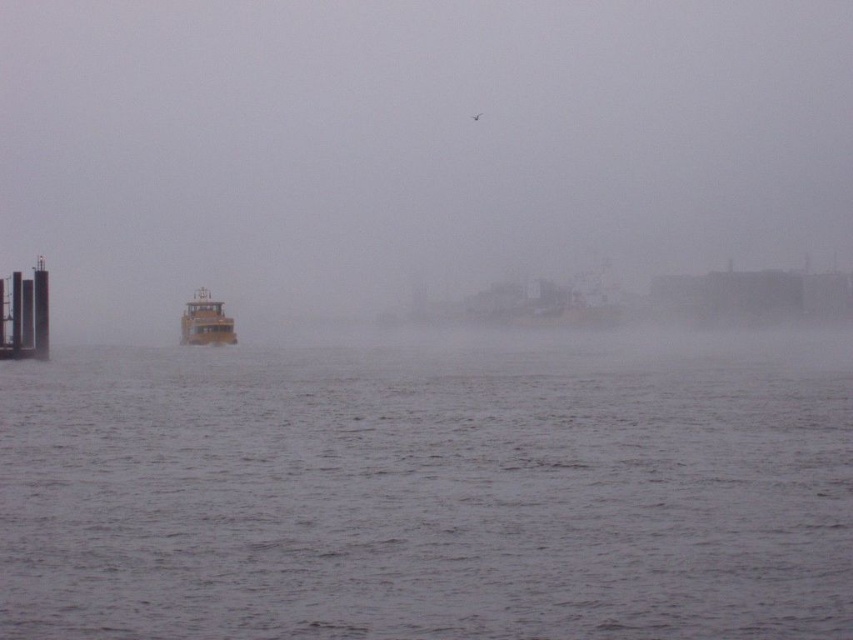
Who is more distant from viewer, (412, 243) or (12, 632)?

Positioned behind is point (412, 243).

Does point (401, 33) come in front of point (177, 403)?

No, it is not.

You are a GUI agent. You are given a task and a screenshot of the screen. Output one action in this format:
    pyautogui.click(x=<x>, y=<y>)
    Task: Click on the foggy atmosphere at left
    The width and height of the screenshot is (853, 640).
    Given the screenshot: What is the action you would take?
    pyautogui.click(x=410, y=147)

Consider the image. Who is positioned more to the left, smooth concrete dock at left or yellow matte boat at center?

smooth concrete dock at left

Who is more distant from viewer, [9,358] or [190,312]?

The point [190,312] is more distant.

This screenshot has width=853, height=640. In order to click on smooth concrete dock at left in this screenshot , I will do `click(25, 316)`.

Can you confirm if foggy atmosphere at left is thinner than yellow matte boat at center?

No.

Where is `foggy atmosphere at left`? The width and height of the screenshot is (853, 640). foggy atmosphere at left is located at coordinates (410, 147).

I want to click on foggy atmosphere at left, so click(410, 147).